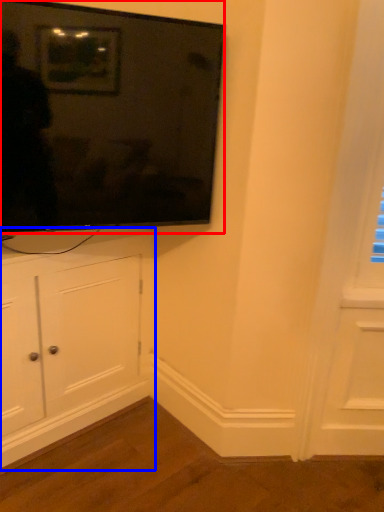
Question: Which object appears closest to the camera in this image, television (highlighted by a red box) or cabinetry (highlighted by a blue box)?

Choices:
 (A) television
 (B) cabinetry

Answer: (A)